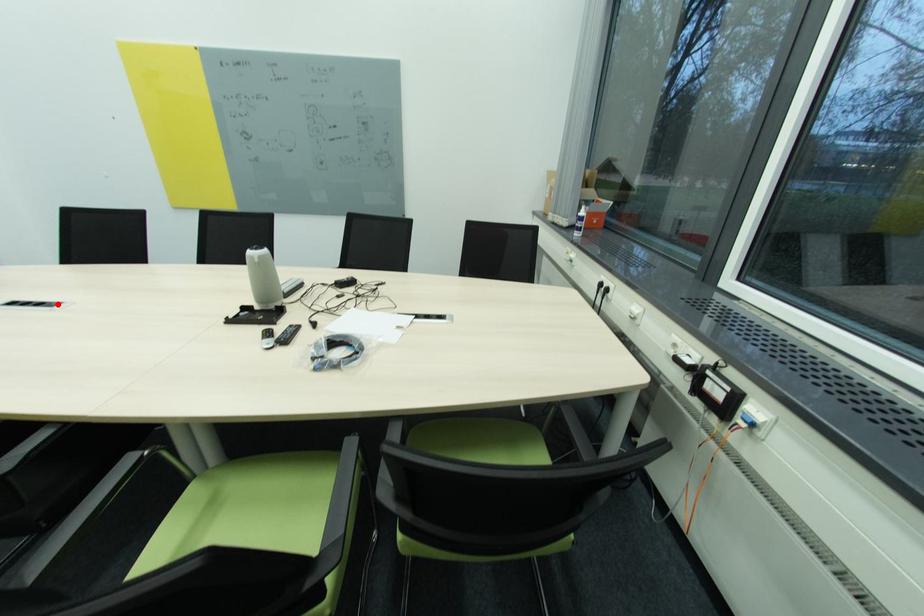
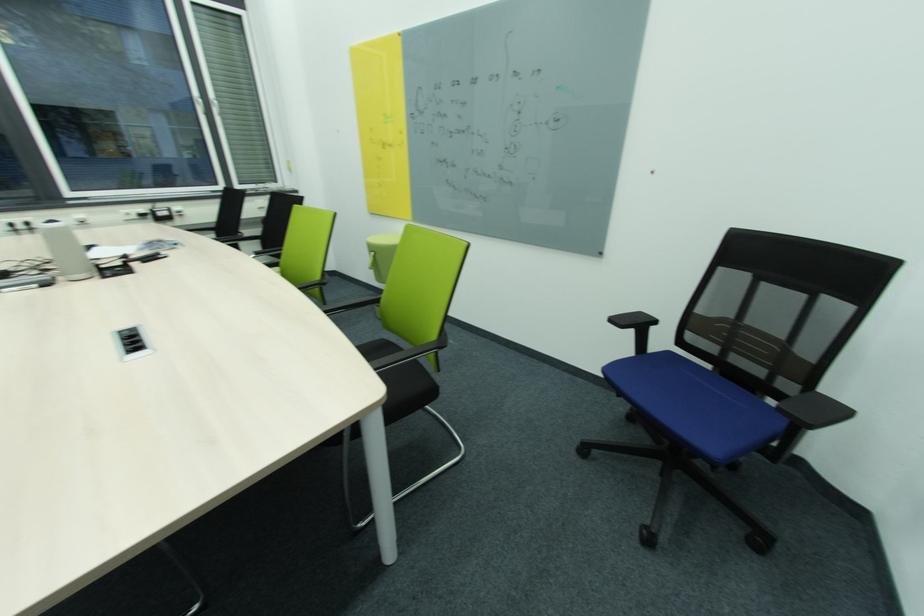
In the second image, find the point that corresponds to the highlighted location in the first image.

(126, 338)